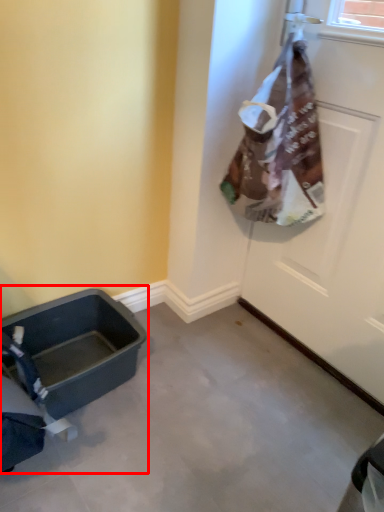
Question: Where is baby carriage (annotated by the red box) located in relation to door in the image?

Choices:
 (A) left
 (B) right

Answer: (A)